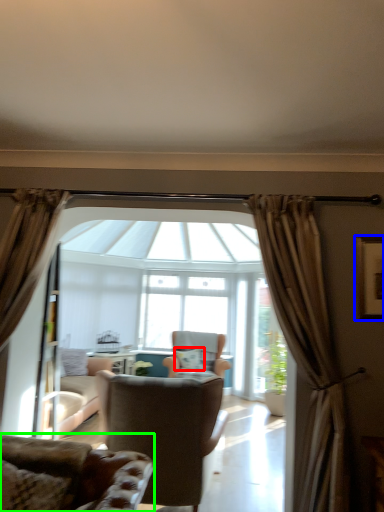
Question: Considering the real-world distances, which object is closest to pillow (highlighted by a red box)? picture frame (highlighted by a blue box) or chair (highlighted by a green box).

Choices:
 (A) picture frame
 (B) chair

Answer: (A)